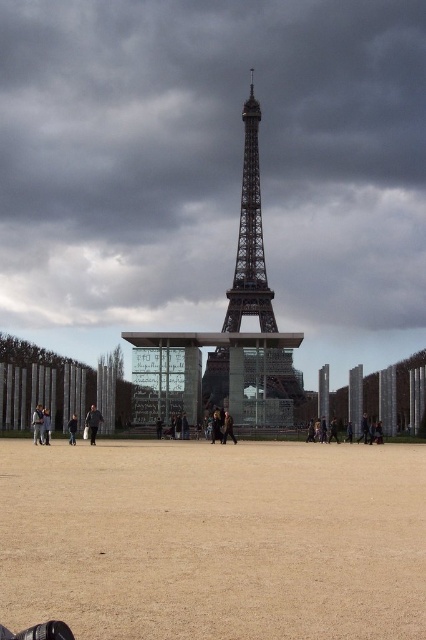
Question: Can you confirm if brown sandy dirt field at center is positioned below dark brown leather jacket at center?

Choices:
 (A) no
 (B) yes

Answer: (B)

Question: Estimate the real-world distances between objects in this image. Which object is closer to the dark gray fabric jacket at center?

Choices:
 (A) brown sandy dirt field at center
 (B) dark gray cloudy sky at upper center
 (C) dark gray jacket at center

Answer: (C)

Question: Where is dark gray cloudy sky at upper center located in relation to metallic structure at center in the image?

Choices:
 (A) left
 (B) right

Answer: (A)

Question: Which point appears farthest from the camera in this image?

Choices:
 (A) (85, 525)
 (B) (37, 420)

Answer: (B)

Question: Estimate the real-world distances between objects in this image. Which object is farther from the metallic structure at center?

Choices:
 (A) brown sandy dirt field at center
 (B) dark gray jacket at center
 (C) dark brown leather jacket at center

Answer: (C)

Question: Does metallic structure at center appear on the left side of dark gray fabric jacket at center?

Choices:
 (A) yes
 (B) no

Answer: (B)